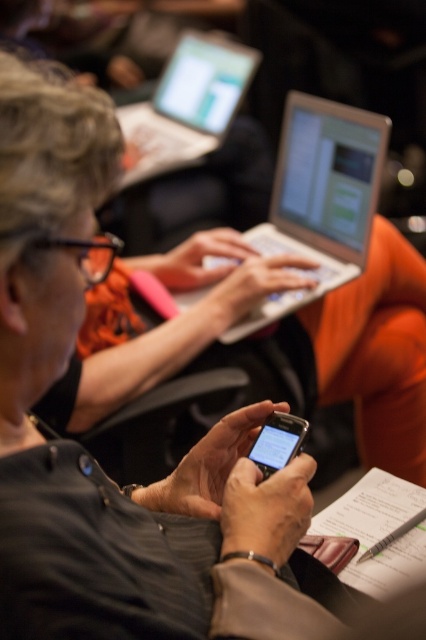
You are organizing a tech workshop and need to place a new projector screen in the room. The projector screen will be placed at point 0.312, 0.749. Is the silver metallic laptop at center currently located at that position?

Yes, the silver metallic laptop at center is located at point (319, 198), so placing the projector screen there would require moving the laptop first.

You are organizing a tech workshop and need to arrange the devices in a specific order. According to the image, which device is positioned higher up between the silver metallic laptop at upper center and the matte black smartphone at center?

The silver metallic laptop at upper center is positioned higher up than the matte black smartphone at center.